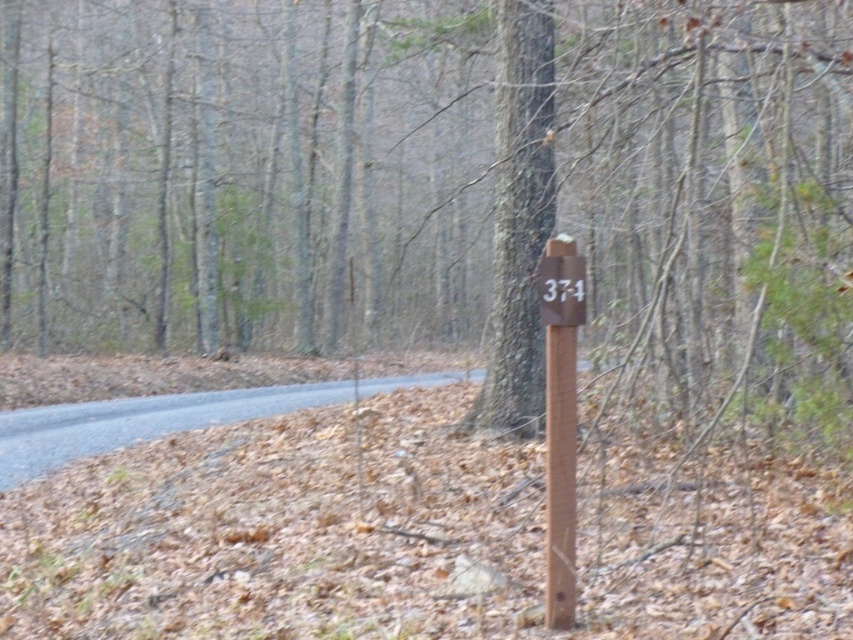
Is point (334, 385) less distant than point (566, 579)?

No, it is not.

Consider the image. Does gray asphalt road at lower left appear under brown wooden post at center?

Yes, gray asphalt road at lower left is below brown wooden post at center.

Between point (12, 412) and point (569, 392), which one is positioned in front?

Point (569, 392) is in front.

Locate an element on the screen. The image size is (853, 640). gray asphalt road at lower left is located at coordinates (166, 417).

Can you confirm if brown wood signpost at center is wider than brown wooden post at center?

Yes, brown wood signpost at center is wider than brown wooden post at center.

Looking at this image, is brown wood signpost at center shorter than brown wooden post at center?

No, brown wood signpost at center is not shorter than brown wooden post at center.

In order to click on brown wood signpost at center in this screenshot , I will do `click(439, 188)`.

Identify the location of brown wood signpost at center. The image size is (853, 640). (439, 188).

Does brown wood signpost at center appear over gray asphalt road at lower left?

Yes, brown wood signpost at center is above gray asphalt road at lower left.

Is point (393, 102) in front of point (149, 435)?

No.

Is point (315, 234) closer to viewer compared to point (190, 404)?

No, it is behind (190, 404).

In order to click on brown wood signpost at center in this screenshot , I will do (x=439, y=188).